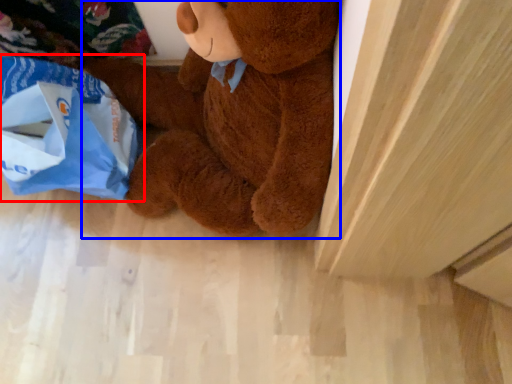
Question: Which point is closer to the camera, grocery bag (highlighted by a red box) or teddy bear (highlighted by a blue box)?

Choices:
 (A) grocery bag
 (B) teddy bear

Answer: (B)